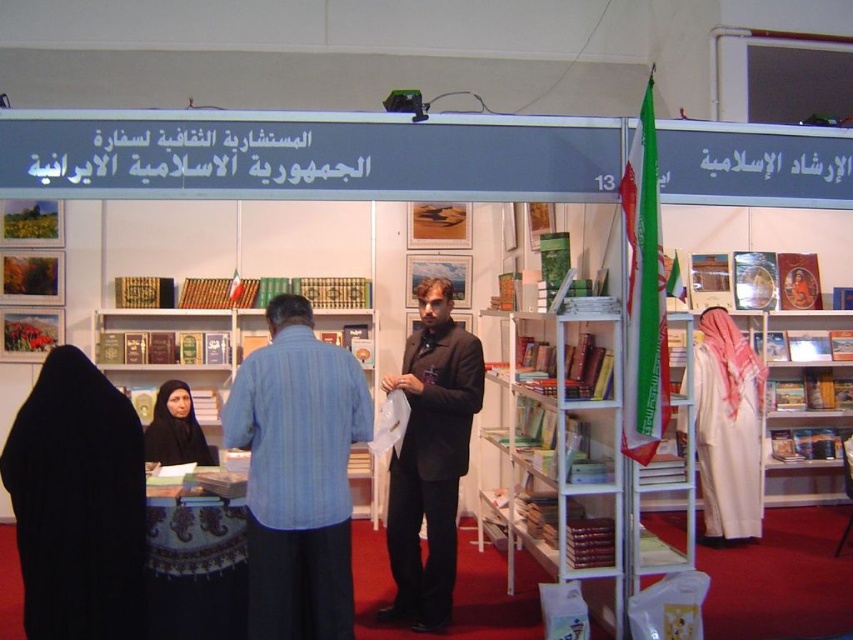
Question: Does blue striped shirt at center appear on the left side of black fabric headscarf at center?

Choices:
 (A) no
 (B) yes

Answer: (A)

Question: Estimate the real-world distances between objects in this image. Which object is farther from the white metal bookshelf at center?

Choices:
 (A) black fabric headscarf at center
 (B) blue striped shirt at center

Answer: (A)

Question: Considering the relative positions of white metal bookshelf at center and black fabric headscarf at center in the image provided, where is white metal bookshelf at center located with respect to black fabric headscarf at center?

Choices:
 (A) below
 (B) above

Answer: (A)

Question: Which object is farther from the camera taking this photo?

Choices:
 (A) blue striped shirt at center
 (B) black fabric headscarf at center

Answer: (B)

Question: Which of the following is the farthest from the observer?

Choices:
 (A) (164, 419)
 (B) (432, 477)
 (C) (149, 316)

Answer: (C)

Question: Can you confirm if white metal bookshelf at center is thinner than matte black suit at center?

Choices:
 (A) yes
 (B) no

Answer: (B)